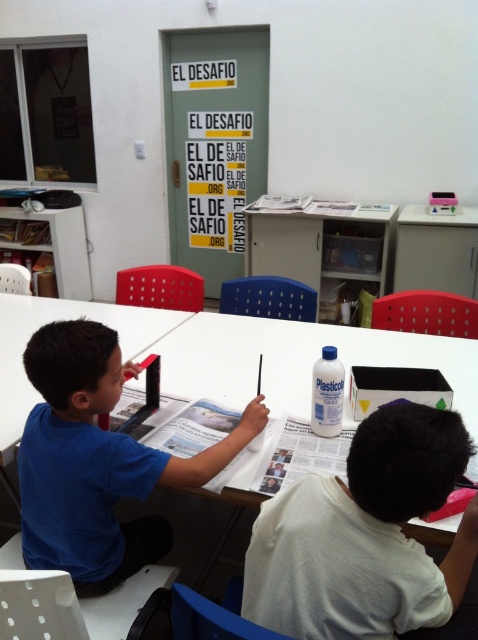
Which is more to the right, white matte shirt at lower right or blue matte shirt at center?

From the viewer's perspective, white matte shirt at lower right appears more on the right side.

Between point (423, 440) and point (52, 520), which one is positioned behind?

The point (52, 520) is more distant.

Identify the location of white matte shirt at lower right. The height and width of the screenshot is (640, 478). (365, 536).